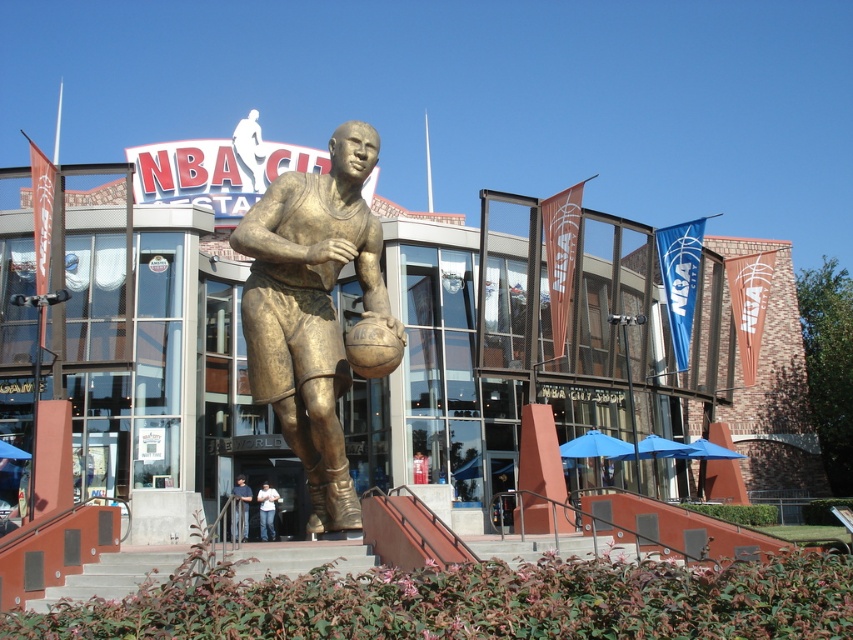
Does point (299, 426) come closer to viewer compared to point (239, 518)?

Yes, it is.

Is point (331, 269) closer to viewer compared to point (236, 516)?

Yes, point (331, 269) is in front of point (236, 516).

Find the location of a particular element. This screenshot has width=853, height=640. bronze basketball player at center is located at coordinates (312, 308).

Can you confirm if concrete stairs at center is positioned to the right of dark blue jeans at center?

Yes, concrete stairs at center is to the right of dark blue jeans at center.

Can you confirm if concrete stairs at center is shorter than dark blue jeans at center?

Yes, concrete stairs at center is shorter than dark blue jeans at center.

Is point (334, 563) positioned behind point (235, 497)?

No, it is not.

Identify the location of concrete stairs at center. (112, 576).

Is the position of gold statue at center less distant than that of dark blue jeans at center?

Yes, it is in front of dark blue jeans at center.

Does gold statue at center appear over dark blue jeans at center?

Yes, gold statue at center is above dark blue jeans at center.

Is point (70, 278) in front of point (235, 531)?

No.

At what (x,y) coordinates should I click in order to perform the action: click on gold statue at center. Please return your answer as a coordinate pair (x, y). Image resolution: width=853 pixels, height=640 pixels. Looking at the image, I should click on (560, 356).